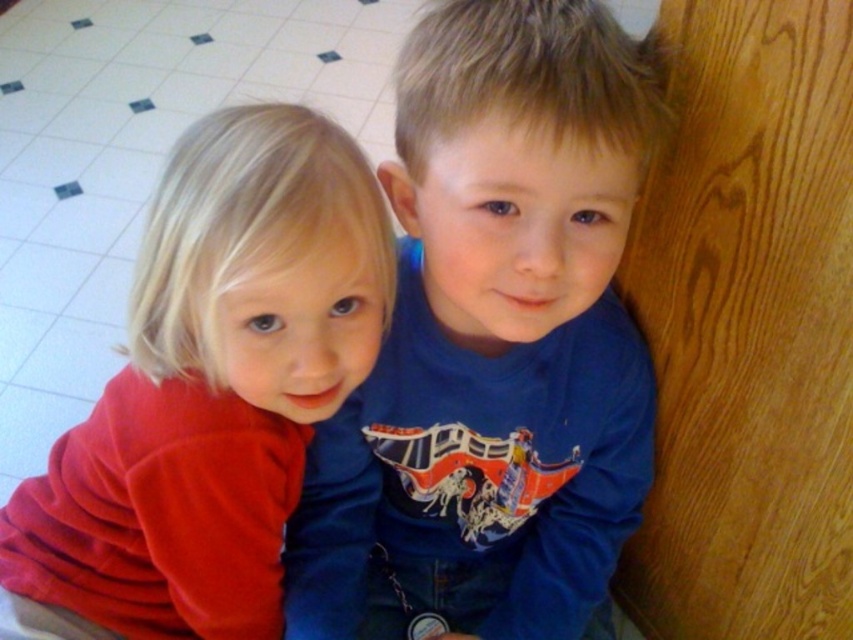
Question: Observing the image, what is the correct spatial positioning of blue cotton shirt at center in reference to matte red shirt at left?

Choices:
 (A) left
 (B) right

Answer: (B)

Question: Can you confirm if blue cotton shirt at center is positioned to the left of matte red shirt at left?

Choices:
 (A) no
 (B) yes

Answer: (A)

Question: Can you confirm if blue cotton shirt at center is positioned to the right of matte red shirt at left?

Choices:
 (A) no
 (B) yes

Answer: (B)